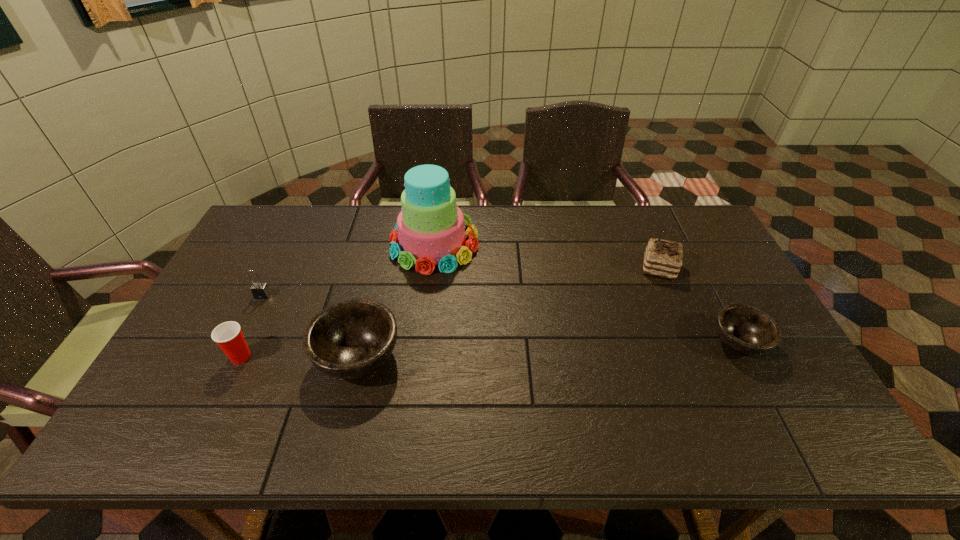
Where is `blank area located 0.060m on the shackle of the padlock`? This screenshot has height=540, width=960. blank area located 0.060m on the shackle of the padlock is located at coordinates coord(253,315).

Image resolution: width=960 pixels, height=540 pixels. Find the location of `free space located on the front of the chocolate cake`. free space located on the front of the chocolate cake is located at coordinates (670, 294).

You are a GUI agent. You are given a task and a screenshot of the screen. Output one action in this format:
    pyautogui.click(x=<x>, y=<y>)
    Task: Click on the free space located 0.320m on the right of the Dixie cup
    
    Given the screenshot: What is the action you would take?
    pyautogui.click(x=377, y=357)

The width and height of the screenshot is (960, 540). I want to click on object that is at the far edge, so [430, 230].

Locate an element on the screen. The image size is (960, 540). object present at the near edge is located at coordinates (351, 338).

Identify the location of padlock at the left edge. (260, 290).

At what (x,y) coordinates should I click in order to perform the action: click on Dixie cup present at the left edge. Please return your answer as a coordinate pair (x, y). Looking at the image, I should click on (228, 335).

At what (x,y) coordinates should I click in order to perform the action: click on object that is at the right edge. Please return your answer as a coordinate pair (x, y). The height and width of the screenshot is (540, 960). Looking at the image, I should click on [x=745, y=329].

The height and width of the screenshot is (540, 960). I want to click on free space at the far edge of the desktop, so click(648, 242).

In the image, there is a desktop. Where is `vacant space at the near edge`? The image size is (960, 540). vacant space at the near edge is located at coordinates (x=304, y=396).